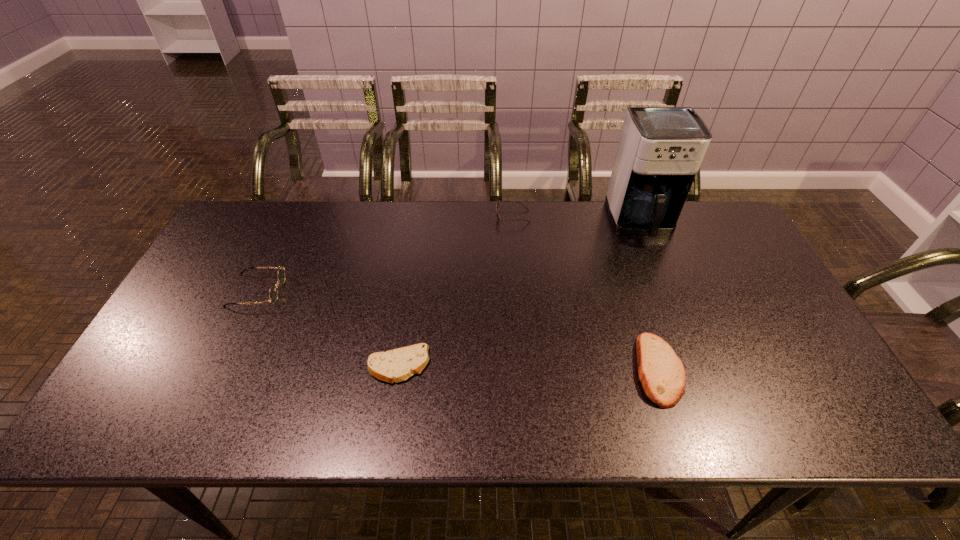
You are a GUI agent. You are given a task and a screenshot of the screen. Output one action in this format:
    pyautogui.click(x=<x>, y=<y>)
    Task: Click on the free point between the sunglasses and the fourth shortest object
    
    Given the screenshot: What is the action you would take?
    pyautogui.click(x=385, y=254)

Where is `free space between the third object from right to left and the second object from left to right`? The height and width of the screenshot is (540, 960). free space between the third object from right to left and the second object from left to right is located at coordinates (455, 291).

Image resolution: width=960 pixels, height=540 pixels. Identify the location of free space between the tallest object and the shorter pita bread. (519, 294).

Locate an element on the screen. The width and height of the screenshot is (960, 540). free point between the tallest object and the left pita bread is located at coordinates (519, 294).

Locate which object is the third closest to the sunglasses. Please provide its 2D coordinates. Your answer should be formatted as a tuple, i.e. [(x, y)], where the tuple contains the x and y coordinates of a point satisfying the conditions above.

[(396, 365)]

Identify which object is the second nearest to the sunglasses. Please provide its 2D coordinates. Your answer should be formatted as a tuple, i.e. [(x, y)], where the tuple contains the x and y coordinates of a point satisfying the conditions above.

[(662, 374)]

I want to click on vacant space that satisfies the following two spatial constraints: 1. on the front-facing side of the sunglasses; 2. on the front side of the shorter pita bread, so click(x=525, y=366).

Identify the location of vacant region that satisfies the following two spatial constraints: 1. on the front-facing side of the third object from left to right; 2. on the back side of the taller pita bread. Image resolution: width=960 pixels, height=540 pixels. (525, 369).

Find the location of a particular element. vacant area that satisfies the following two spatial constraints: 1. on the back side of the right pita bread; 2. on the front-facing side of the sunglasses is located at coordinates (609, 217).

Find the location of a particular element. free spot that satisfies the following two spatial constraints: 1. on the front panel of the tallest object; 2. on the lenses of the leftmost object is located at coordinates (668, 291).